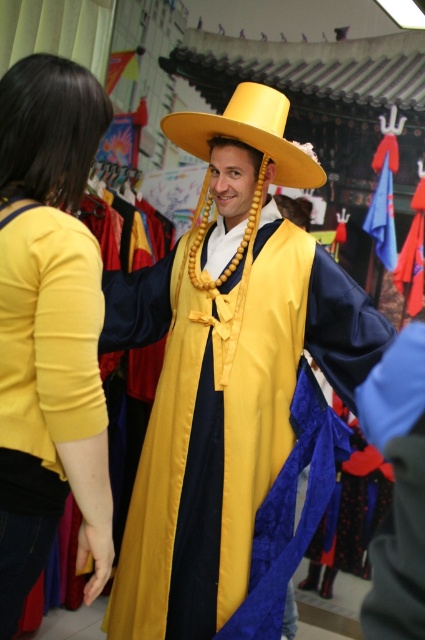
Question: Does matte yellow blouse at left have a smaller size compared to yellow matte cowboy hat at center?

Choices:
 (A) yes
 (B) no

Answer: (A)

Question: Which object is positioned farthest from the satin yellow robe at center?

Choices:
 (A) matte yellow blouse at left
 (B) yellow matte cowboy hat at center

Answer: (A)

Question: Is the position of matte yellow blouse at left less distant than that of yellow matte cowboy hat at center?

Choices:
 (A) no
 (B) yes

Answer: (B)

Question: Is satin yellow robe at center wider than matte yellow blouse at left?

Choices:
 (A) yes
 (B) no

Answer: (A)

Question: Which point appears farthest from the camera in this image?

Choices:
 (A) (249, 204)
 (B) (175, 113)

Answer: (A)

Question: Which of the following is the farthest from the observer?

Choices:
 (A) (244, 141)
 (B) (44, 120)

Answer: (A)